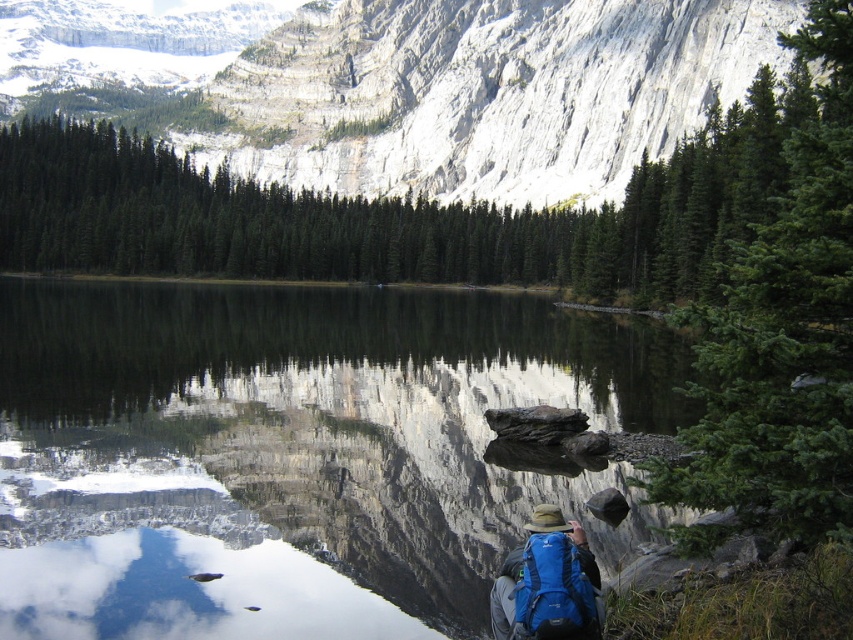
From the picture: You are standing at the edge of the smooth reflective water at center and want to take a photo of the white rocky mountain at upper center. Since the water is reflective, will you be able to see the mountain reflected in the water?

Yes, because the smooth reflective water at center is located below the white rocky mountain at upper center, so the mountain would be reflected in the water.

You are standing at the edge of the lake and want to take a photo of the smooth reflective water at center and the blue fabric backpack at lower center. Which object appears larger in the photo?

The smooth reflective water at center appears larger in the photo because it is much taller than the blue fabric backpack at lower center.

You are standing at the origin point in the coordinate system of the image. Which direction should you move to reach the smooth reflective water at center?

The smooth reflective water at center is located at coordinates point (294, 452). Since the x coordinate is 0.709 which is greater than 0.5, you should move to the right. The y coordinate is 0.346 which is less than 0.5, so you should move downward. Therefore, you should move diagonally to the right and downward to reach the smooth reflective water at center.